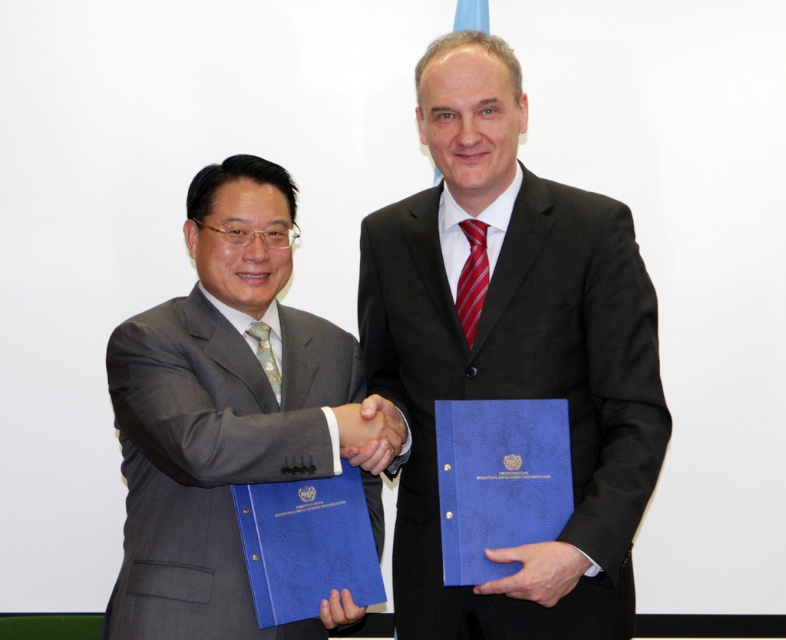
Question: Can you confirm if smooth leather hand at center is bigger than green silk tie at left?

Choices:
 (A) yes
 (B) no

Answer: (A)

Question: Which point is closer to the camera taking this photo?

Choices:
 (A) (553, 544)
 (B) (274, 212)
 (C) (263, 356)

Answer: (A)

Question: Which point is closer to the camera taking this photo?

Choices:
 (A) (458, 221)
 (B) (432, 499)

Answer: (B)

Question: Does smooth leather hand at center appear on the left side of red striped tie at center?

Choices:
 (A) yes
 (B) no

Answer: (B)

Question: Which of the following is the farthest from the observer?

Choices:
 (A) (573, 385)
 (B) (382, 449)
 (C) (324, 620)

Answer: (A)

Question: Is the position of black matte suit at center less distant than that of matte black hand at lower center?

Choices:
 (A) yes
 (B) no

Answer: (B)